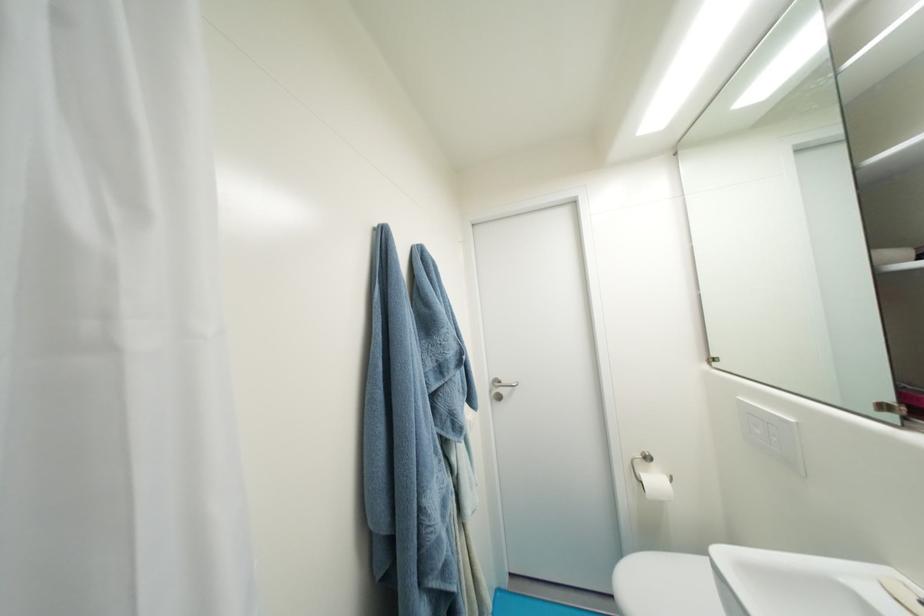
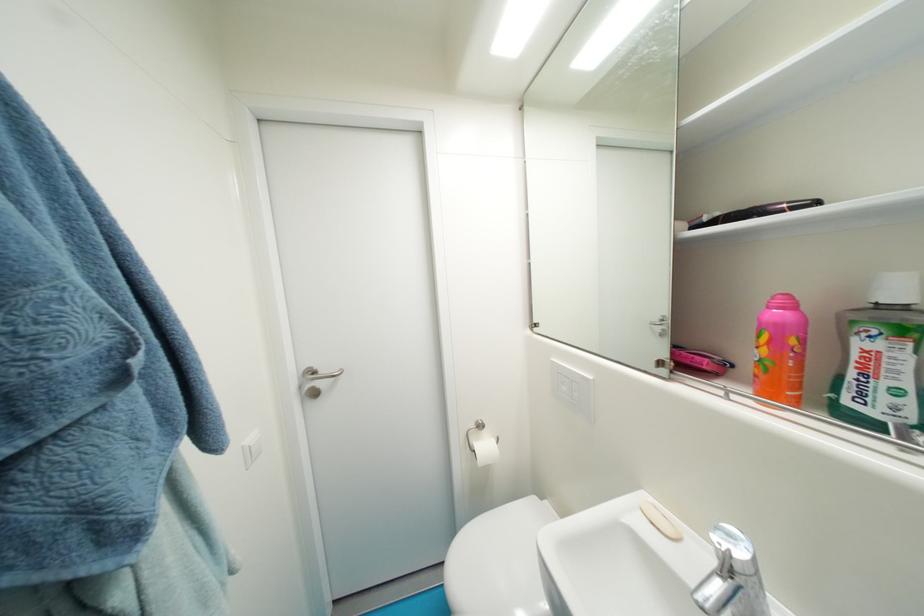
Where in the second image is the point corresponding to (x=505, y=384) from the first image?

(322, 374)